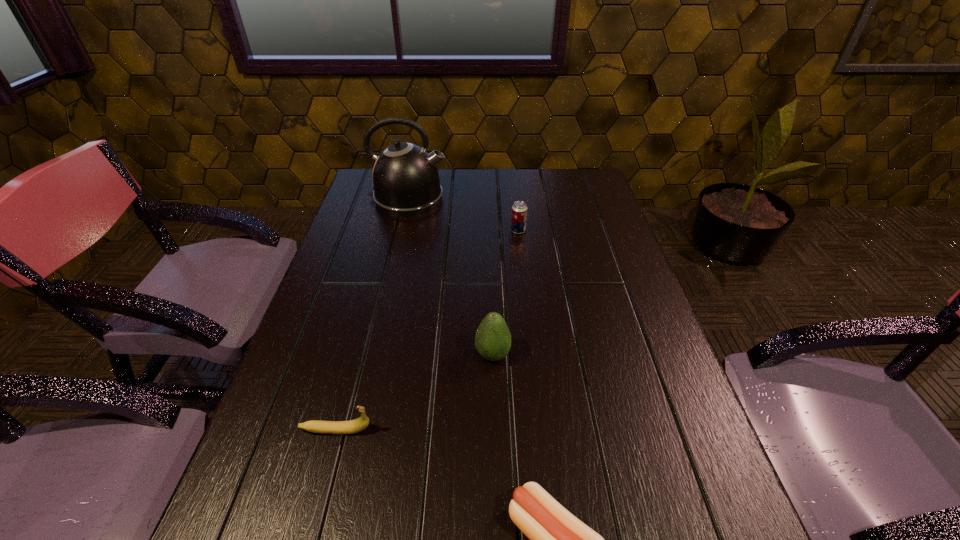
Image resolution: width=960 pixels, height=540 pixels. I want to click on object that is at the far edge, so click(x=405, y=178).

You are a GUI agent. You are given a task and a screenshot of the screen. Output one action in this format:
    pyautogui.click(x=<x>, y=<y>)
    Task: Click on the kettle situated at the left edge
    This screenshot has height=540, width=960.
    Given the screenshot: What is the action you would take?
    pyautogui.click(x=405, y=178)

Image resolution: width=960 pixels, height=540 pixels. Identify the location of banana at the left edge. (316, 426).

Identify the location of object present at the far left corner. (405, 178).

The width and height of the screenshot is (960, 540). What are the coordinates of `vacant point at the far edge` in the screenshot? It's located at (498, 196).

In the image, there is a desktop. Where is `vacant space at the left edge`? vacant space at the left edge is located at coordinates (252, 455).

You are a GUI agent. You are given a task and a screenshot of the screen. Output one action in this format:
    pyautogui.click(x=<x>, y=<y>)
    Task: Click on the blank space at the right edge
    
    Given the screenshot: What is the action you would take?
    pyautogui.click(x=569, y=228)

In order to click on free space at the far right corner of the desktop in this screenshot , I will do `click(563, 202)`.

The image size is (960, 540). Identify the location of vacant region between the avocado and the fourth farthest object. (415, 392).

Identify the location of free area in between the farthest object and the beer can. This screenshot has width=960, height=540. [x=464, y=214].